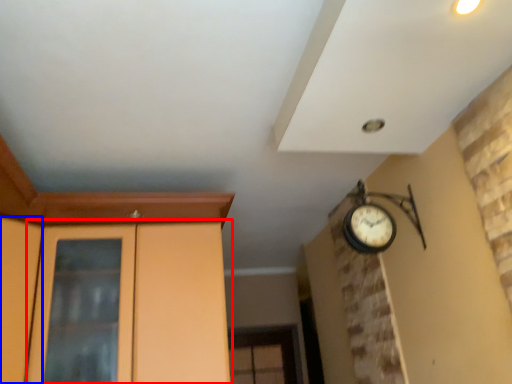
Question: Which point is further to the camera, dresser (highlighted by a red box) or door (highlighted by a blue box)?

Choices:
 (A) dresser
 (B) door

Answer: (A)